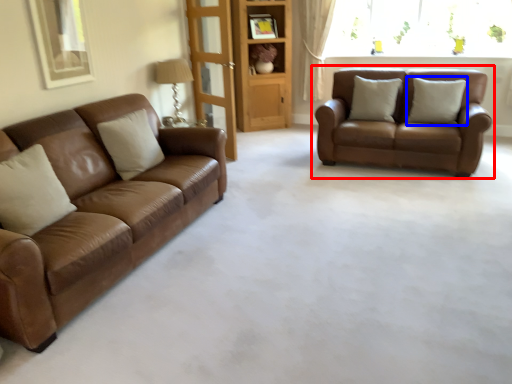
Question: Which point is closer to the camera, studio couch (highlighted by a red box) or pillow (highlighted by a blue box)?

Choices:
 (A) studio couch
 (B) pillow

Answer: (A)